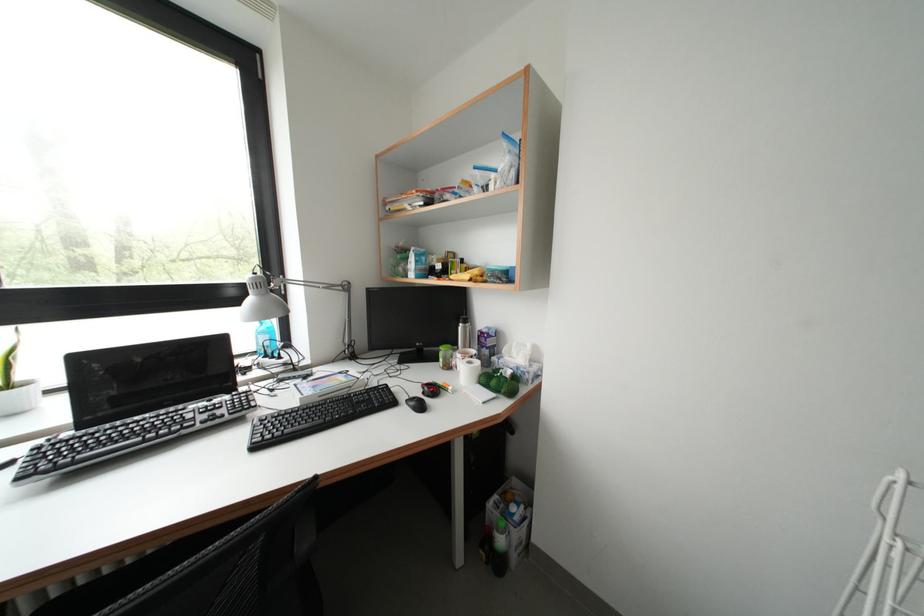
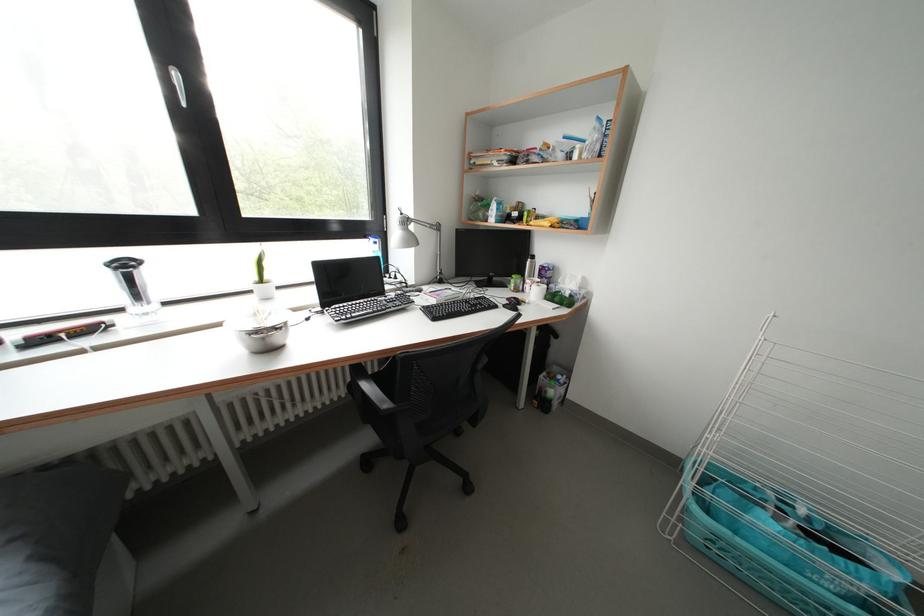
Find the pixel in the second image that matches [261,278] in the first image.

(408, 219)